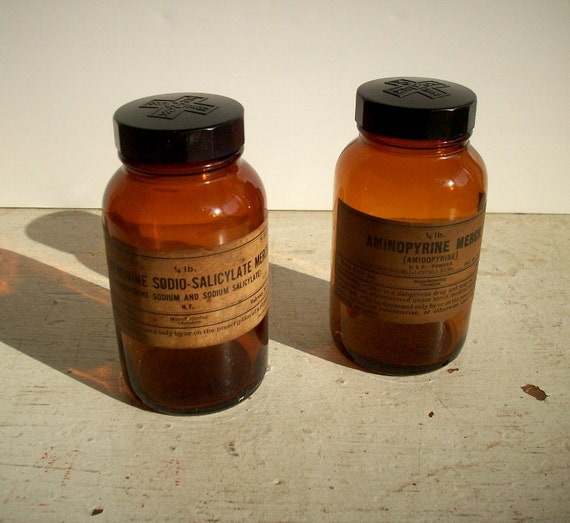
The image size is (570, 523). I want to click on old empty medicine bottle 2, so click(x=412, y=200).